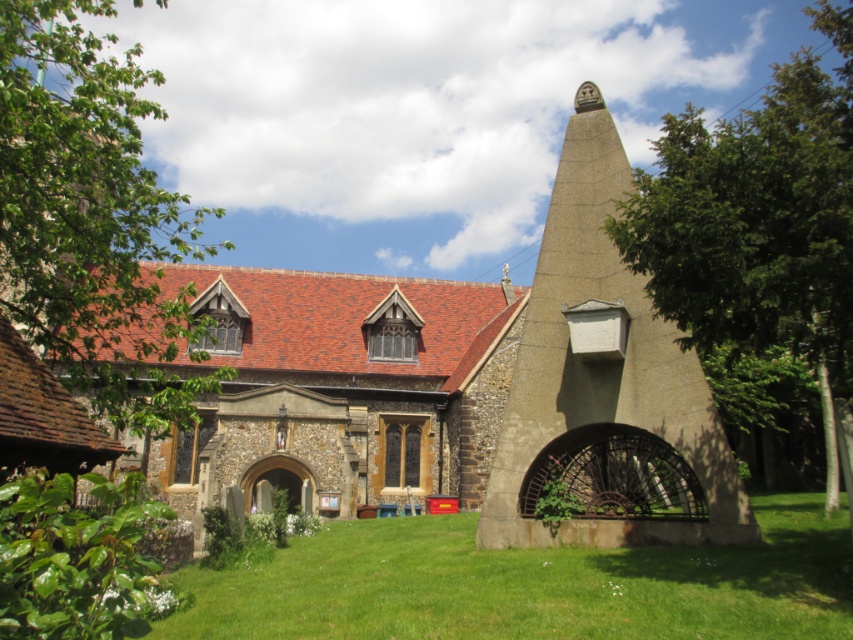
Does green grass at lower center have a lesser height compared to green leafy tree at right?

Yes.

Locate an element on the screen. This screenshot has width=853, height=640. green grass at lower center is located at coordinates (529, 584).

Measure the distance between green grass at lower center and camera.

green grass at lower center and camera are 32.44 meters apart.

Locate an element on the screen. Image resolution: width=853 pixels, height=640 pixels. green grass at lower center is located at coordinates (529, 584).

Consider the image. Does green leafy tree at left have a larger size compared to green leafy tree at right?

No.

You are a GUI agent. You are given a task and a screenshot of the screen. Output one action in this format:
    pyautogui.click(x=<x>, y=<y>)
    Task: Click on the green leafy tree at left
    The image size is (853, 640).
    Given the screenshot: What is the action you would take?
    click(91, 220)

Locate an element on the screen. green leafy tree at left is located at coordinates (91, 220).

Who is more distant from viewer, (741, 499) or (189, 400)?

Positioned behind is point (189, 400).

Which is more to the right, brown stone church at center or green leafy tree at left?

From the viewer's perspective, brown stone church at center appears more on the right side.

Measure the distance between brown stone church at center and camera.

They are 145.78 feet apart.

At what (x,y) coordinates should I click in order to perform the action: click on brown stone church at center. Please return your answer as a coordinate pair (x, y). Image resolution: width=853 pixels, height=640 pixels. Looking at the image, I should click on (473, 387).